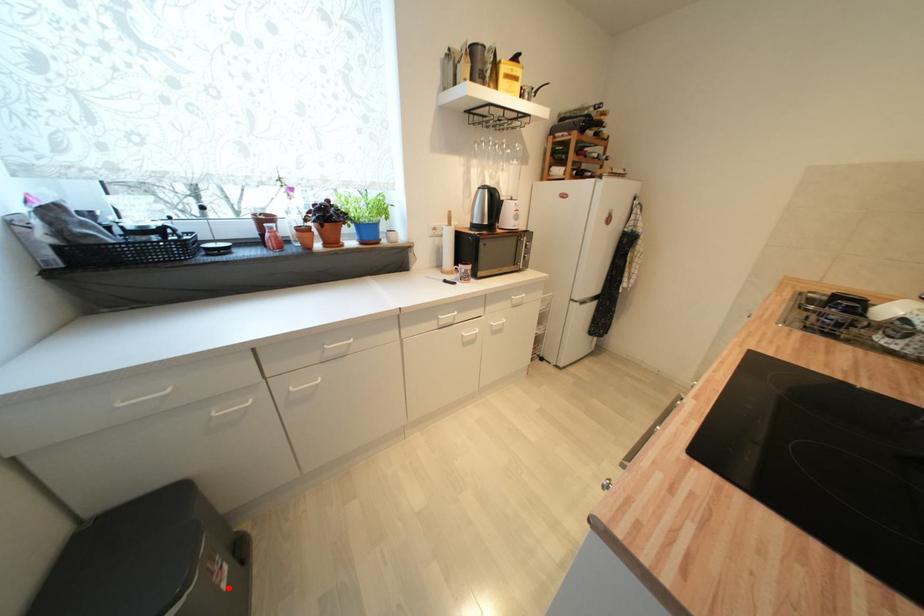
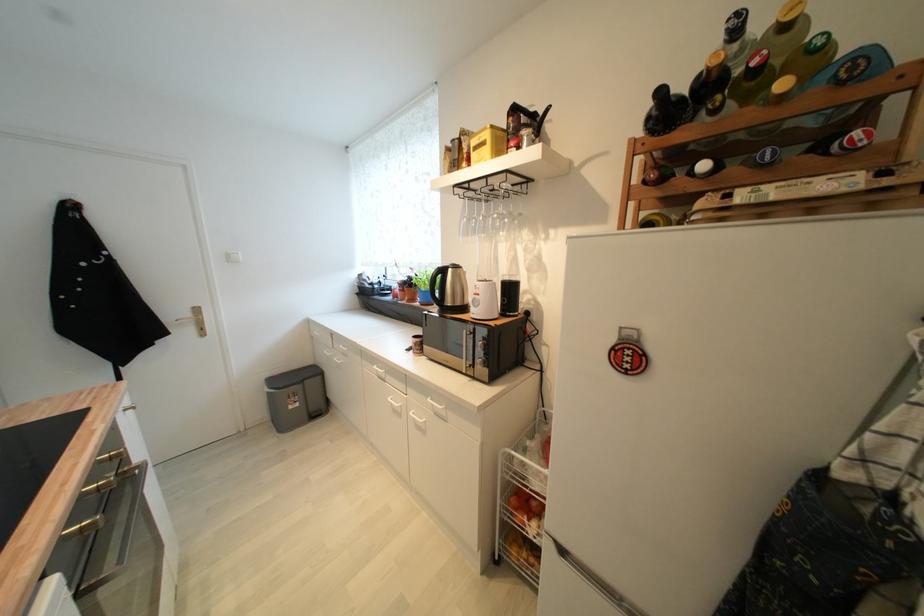
The point at the highlighted location is marked in the first image. Where is the corresponding point in the second image?

(296, 408)